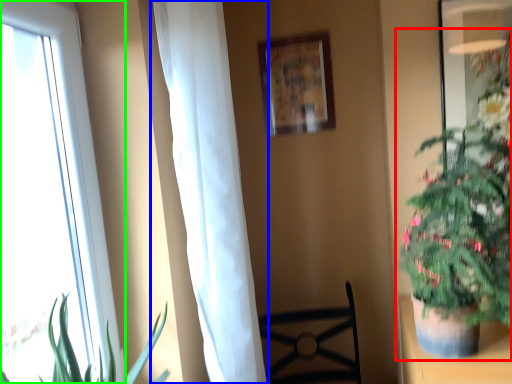
Question: Which object is the farthest from houseplant (highlighted by a red box)? Choose among these: curtain (highlighted by a blue box) or window (highlighted by a green box).

Choices:
 (A) curtain
 (B) window

Answer: (B)